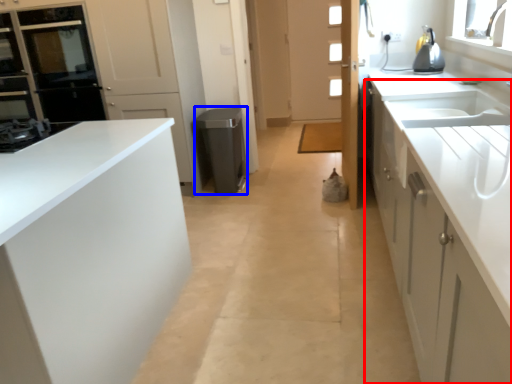
Question: Among these objects, which one is nearest to the camera, cabinetry (highlighted by a red box) or appliance (highlighted by a blue box)?

Choices:
 (A) cabinetry
 (B) appliance

Answer: (A)